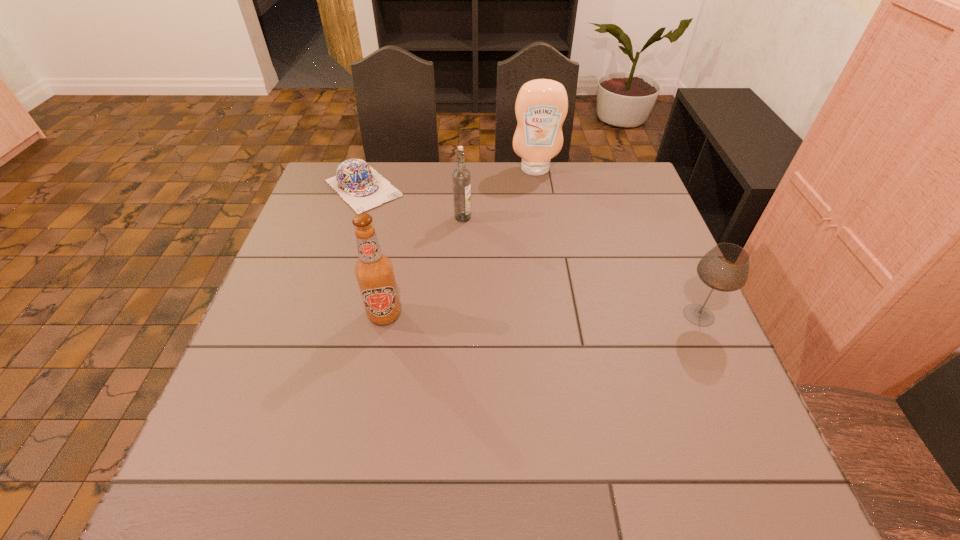
Where is `free space that is in between the condiment and the wineglass`? free space that is in between the condiment and the wineglass is located at coordinates tap(617, 242).

I want to click on free space between the third object from left to right and the cap, so 413,203.

Locate an element on the screen. The height and width of the screenshot is (540, 960). free spot between the third tallest object and the wineglass is located at coordinates (581, 266).

The height and width of the screenshot is (540, 960). I want to click on free space between the beer bottle and the third shortest object, so click(423, 266).

You are a GUI agent. You are given a task and a screenshot of the screen. Output one action in this format:
    pyautogui.click(x=<x>, y=<y>)
    Task: Click on the empty space that is in between the condiment and the shortest object
    The width and height of the screenshot is (960, 540).
    Given the screenshot: What is the action you would take?
    pyautogui.click(x=449, y=179)

You are a GUI agent. You are given a task and a screenshot of the screen. Output one action in this format:
    pyautogui.click(x=<x>, y=<y>)
    Task: Click on the free space between the rightmost object and the beer bottle
    The height and width of the screenshot is (540, 960).
    Given the screenshot: What is the action you would take?
    pyautogui.click(x=541, y=315)

Identify the location of vacant area that lies between the condiment and the wineglass. (617, 242).

I want to click on free space between the rightmost object and the second object from right to left, so click(617, 242).

I want to click on unoccupied area between the shortest object and the fourth object from left to right, so click(x=449, y=179).

Identify which object is located as the second nearest to the vodka. Please provide its 2D coordinates. Your answer should be formatted as a tuple, i.e. [(x, y)], where the tuple contains the x and y coordinates of a point satisfying the conditions above.

[(541, 106)]